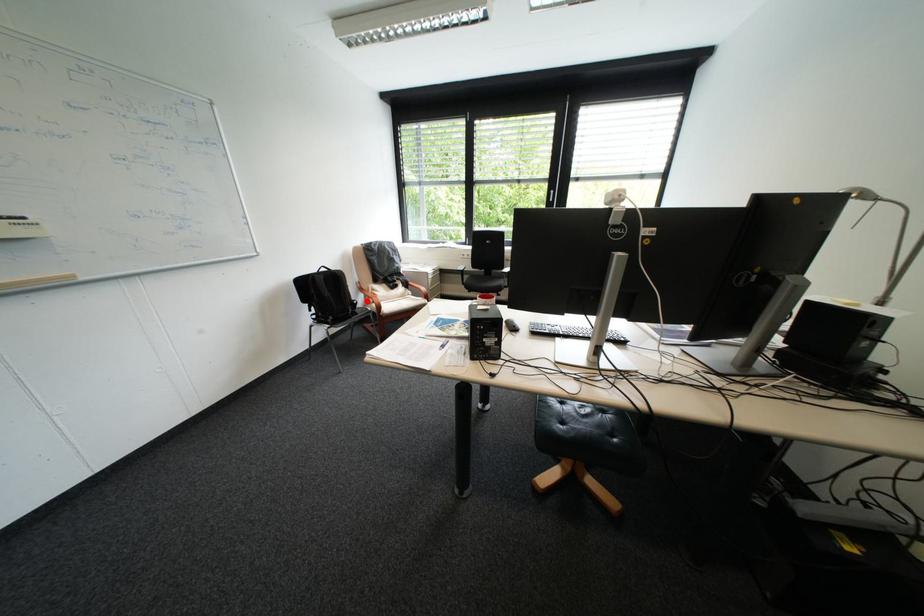
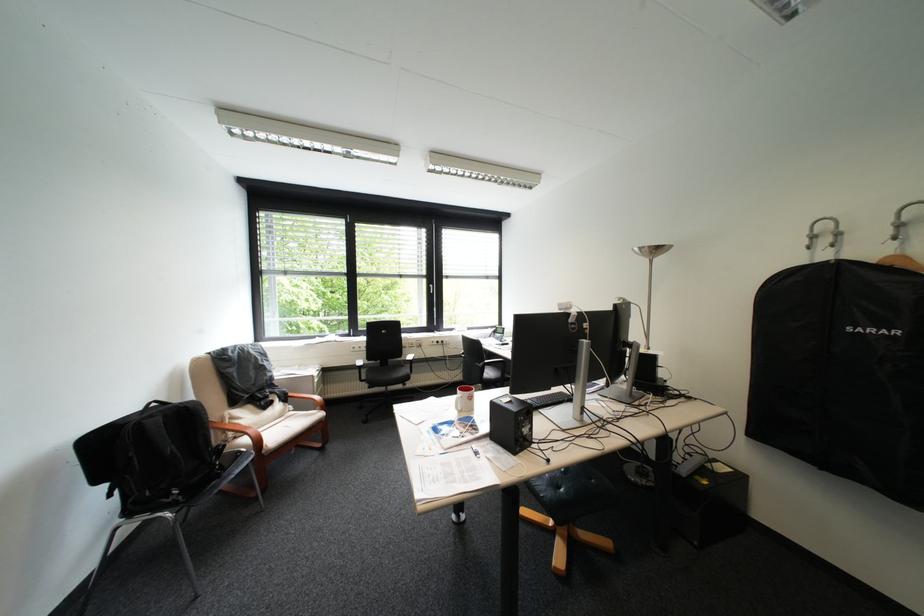
Question: I am providing you with two images of the same scene from different viewpoints. In image1, a red point is highlighted. Considering the same 3D point in image2, which of the following is correct?

Choices:
 (A) It is closer
 (B) It is farther

Answer: (B)